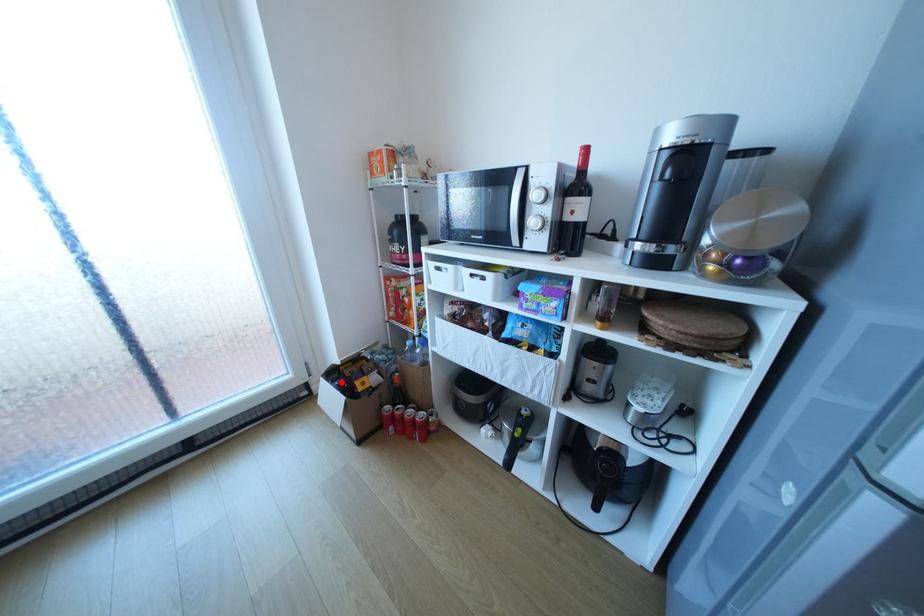
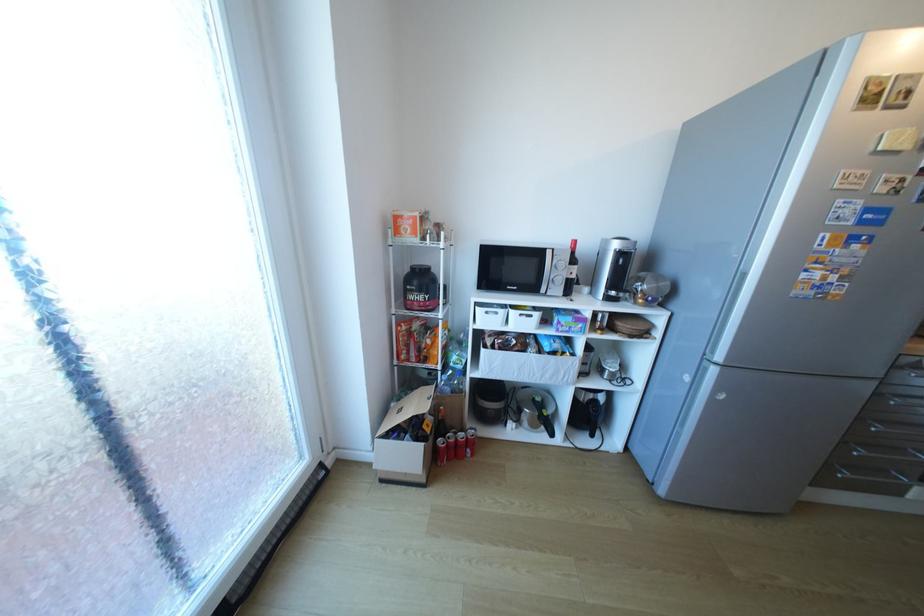
The point at the highlighted location is marked in the first image. Where is the corresponding point in the second image?

(407, 437)